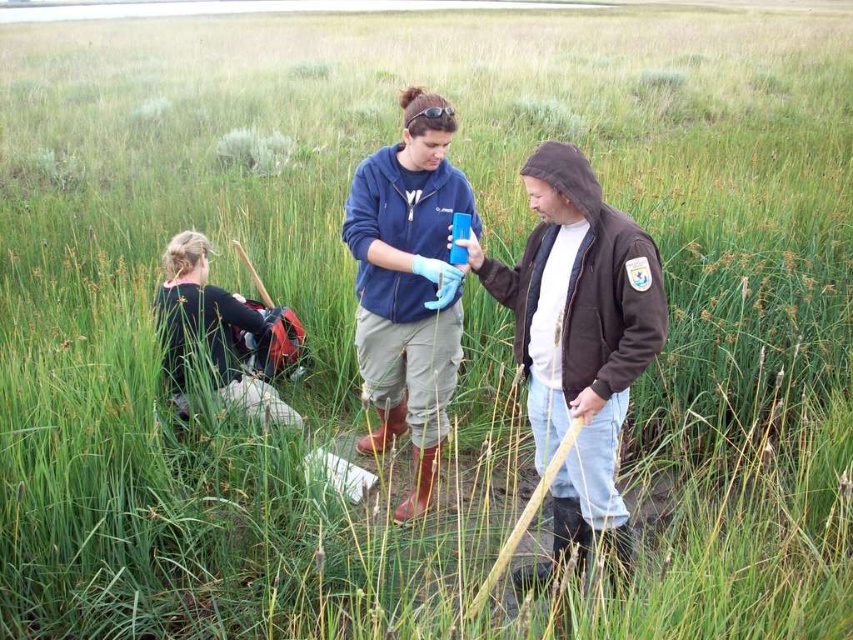
Does brown leather jacket at center appear over dark brown leather jacket at left?

Incorrect, brown leather jacket at center is not positioned above dark brown leather jacket at left.

Is point (572, 499) positioned before point (173, 252)?

Yes, it is.

In order to click on brown leather jacket at center in this screenshot , I will do `click(578, 340)`.

Which is below, blue fabric jacket at center or dark brown leather jacket at left?

dark brown leather jacket at left is lower down.

Is blue fabric jacket at center bigger than dark brown leather jacket at left?

Correct, blue fabric jacket at center is larger in size than dark brown leather jacket at left.

This screenshot has width=853, height=640. I want to click on blue fabric jacket at center, so [x=408, y=284].

I want to click on blue fabric jacket at center, so click(x=408, y=284).

Does brown leather jacket at center have a larger size compared to blue fabric jacket at center?

No.

Is point (579, 333) more distant than point (395, 237)?

No, it is not.

Image resolution: width=853 pixels, height=640 pixels. What do you see at coordinates (578, 340) in the screenshot? I see `brown leather jacket at center` at bounding box center [578, 340].

In order to click on brown leather jacket at center in this screenshot , I will do `click(578, 340)`.